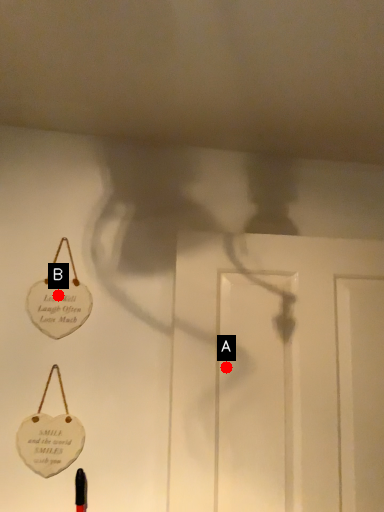
Question: Two points are circled on the image, labeled by A and B beside each circle. Which point is closer to the camera?

Choices:
 (A) A is closer
 (B) B is closer

Answer: (A)